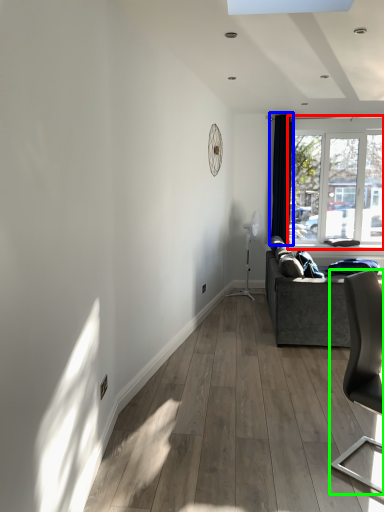
Question: Estimate the real-world distances between objects in this image. Which object is farther from window (highlighted by a red box), curtain (highlighted by a blue box) or chair (highlighted by a green box)?

Choices:
 (A) curtain
 (B) chair

Answer: (B)